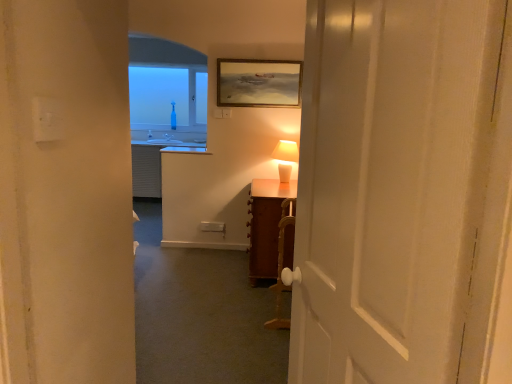
Question: Is white ceramic table lamp at center surrounding wooden cabinet at right?

Choices:
 (A) yes
 (B) no

Answer: (B)

Question: Is white ceramic table lamp at center positioned in front of wooden cabinet at right?

Choices:
 (A) yes
 (B) no

Answer: (B)

Question: From the image's perspective, is white ceramic table lamp at center above wooden cabinet at right?

Choices:
 (A) no
 (B) yes

Answer: (B)

Question: Can you confirm if white ceramic table lamp at center is wider than wooden cabinet at right?

Choices:
 (A) yes
 (B) no

Answer: (B)

Question: Does white ceramic table lamp at center appear on the right side of wooden cabinet at right?

Choices:
 (A) yes
 (B) no

Answer: (A)

Question: Which is correct: white plastic electric outlet at upper center is inside white wooden door at center, or outside of it?

Choices:
 (A) outside
 (B) inside

Answer: (A)

Question: From the image's perspective, is white plastic electric outlet at upper center located above or below white wooden door at center?

Choices:
 (A) above
 (B) below

Answer: (A)

Question: Is white plastic electric outlet at upper center in front of or behind white wooden door at center in the image?

Choices:
 (A) front
 (B) behind

Answer: (B)

Question: In the image, is white plastic electric outlet at upper center on the left side or the right side of white wooden door at center?

Choices:
 (A) left
 (B) right

Answer: (A)

Question: From a real-world perspective, is white wooden door at center above or below gold-framed painting at upper center?

Choices:
 (A) below
 (B) above

Answer: (A)

Question: Based on their positions, is white wooden door at center located to the left or right of gold-framed painting at upper center?

Choices:
 (A) right
 (B) left

Answer: (A)

Question: Looking at the image, does white wooden door at center seem bigger or smaller compared to gold-framed painting at upper center?

Choices:
 (A) small
 (B) big

Answer: (B)

Question: Considering the positions of white wooden door at center and gold-framed painting at upper center in the image, is white wooden door at center wider or thinner than gold-framed painting at upper center?

Choices:
 (A) thin
 (B) wide

Answer: (B)

Question: From the image's perspective, is white plastic electric outlet at upper center above or below transparent glass bottle at upper center?

Choices:
 (A) above
 (B) below

Answer: (B)

Question: Considering the positions of point (215, 107) and point (150, 96), is point (215, 107) closer or farther from the camera than point (150, 96)?

Choices:
 (A) farther
 (B) closer

Answer: (B)